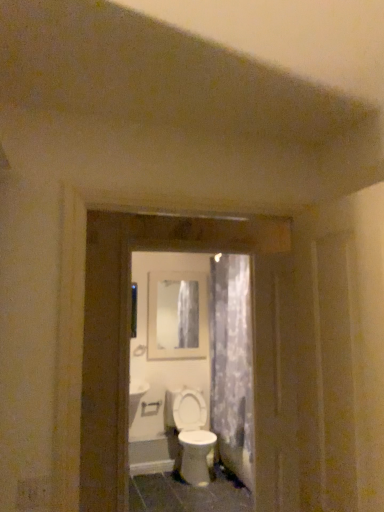
Question: Would you say white glossy screen door at center is to the left or to the right of white plastic door handle at center in the picture?

Choices:
 (A) left
 (B) right

Answer: (B)

Question: From a real-world perspective, is white glossy screen door at center physically located above or below white plastic door handle at center?

Choices:
 (A) above
 (B) below

Answer: (A)

Question: Which of these objects is positioned farthest from the white glossy toilet at center?

Choices:
 (A) matte glass mirror at center
 (B) white glossy screen door at center
 (C) white plastic door handle at center
 (D) translucent floral fabric at center

Answer: (B)

Question: Estimate the real-world distances between objects in this image. Which object is closer to the translucent floral fabric at center?

Choices:
 (A) white plastic door handle at center
 (B) white glossy toilet at center
 (C) white glossy screen door at center
 (D) matte glass mirror at center

Answer: (B)